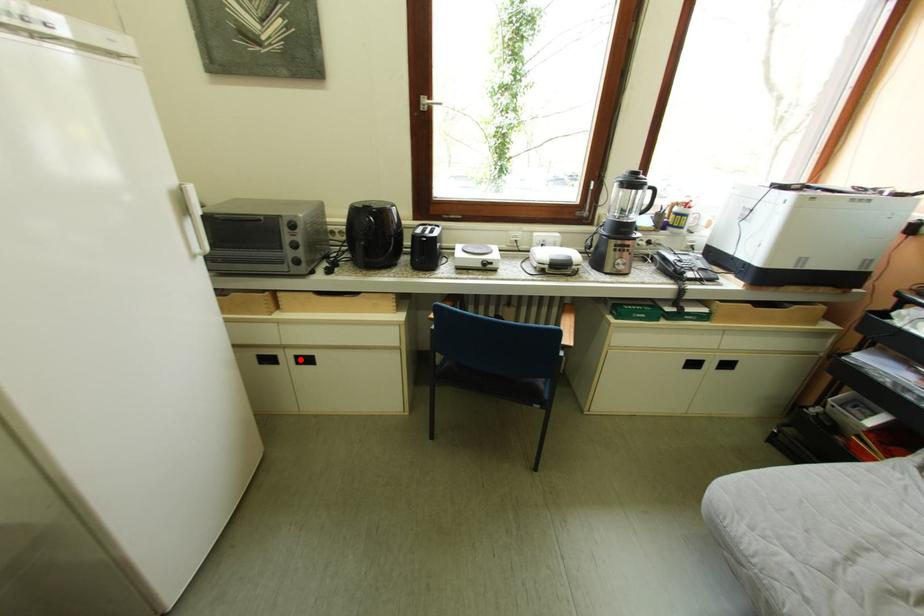
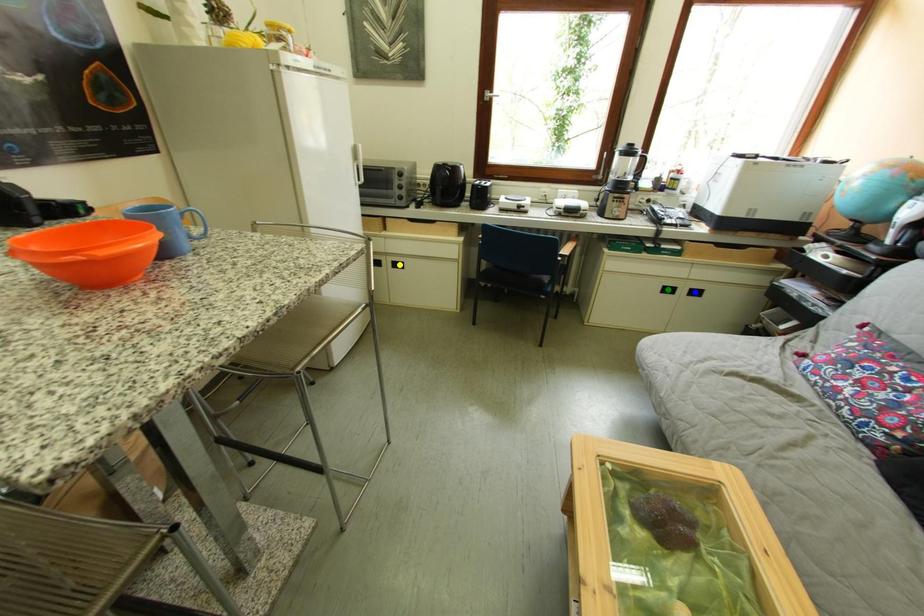
Question: I am providing you with two images of the same scene from different viewpoints. A red point is marked on the first image. You are given multiple points on the second image. Which point in image 2 represents the same 3d spot as the red point in image 1?

Choices:
 (A) yellow point
 (B) green point
 (C) blue point

Answer: (A)